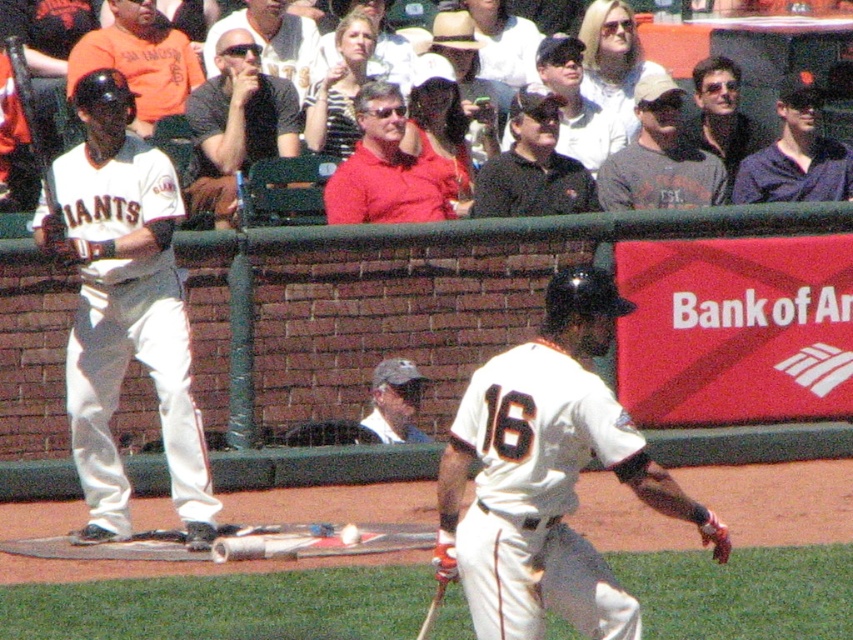
Is black shirt at upper center thinner than black matte shirt at center?

Indeed, black shirt at upper center has a lesser width compared to black matte shirt at center.

Consider the image. How far apart are black shirt at upper center and black matte shirt at center?

The distance of black shirt at upper center from black matte shirt at center is 1.74 meters.

Between point (276, 118) and point (534, 109), which one is positioned in front?

Point (534, 109) is more forward.

This screenshot has width=853, height=640. In order to click on black shirt at upper center in this screenshot , I will do `click(236, 124)`.

Between white matte uniform at center and orange jersey at left, which one appears on the right side from the viewer's perspective?

From the viewer's perspective, white matte uniform at center appears more on the right side.

Between point (616, 589) and point (171, 106), which one is positioned behind?

Point (171, 106)

The width and height of the screenshot is (853, 640). Identify the location of white matte uniform at center. (547, 476).

Is black matte shirt at center wider than orange jersey at left?

No.

Is black matte shirt at center positioned at the back of orange jersey at left?

That is False.

Where is `black matte shirt at center`? Image resolution: width=853 pixels, height=640 pixels. black matte shirt at center is located at coordinates (532, 166).